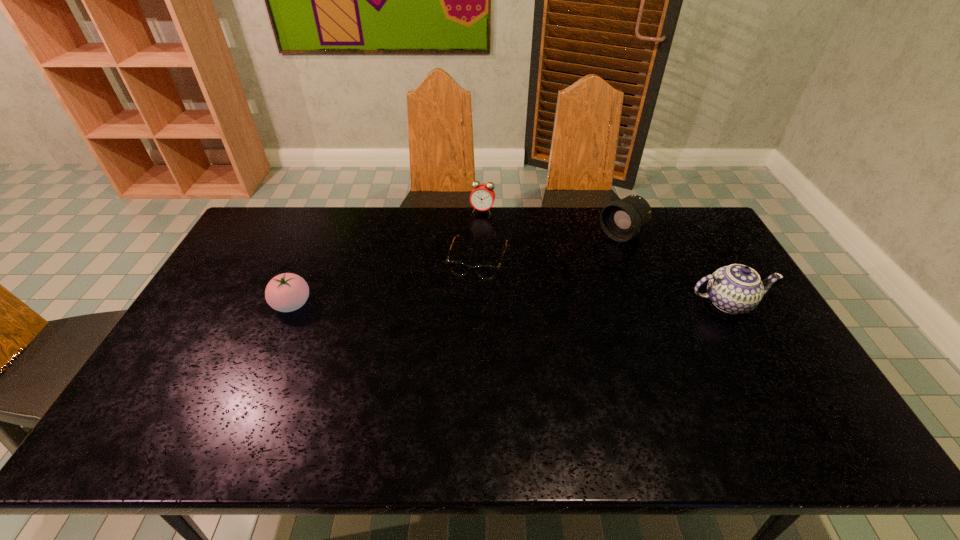
This screenshot has width=960, height=540. Find the location of `the leftmost object`. the leftmost object is located at coordinates (287, 292).

The width and height of the screenshot is (960, 540). I want to click on the rightmost object, so click(x=735, y=289).

Image resolution: width=960 pixels, height=540 pixels. I want to click on the shortest object, so click(487, 272).

The image size is (960, 540). In order to click on telephoto lens in this screenshot , I will do `click(621, 220)`.

Where is `alarm clock`? The height and width of the screenshot is (540, 960). alarm clock is located at coordinates (482, 197).

The width and height of the screenshot is (960, 540). Identify the location of vacant region located 0.150m on the front of the tomato. (268, 362).

Locate an element on the screen. vacant area situated at the spout of the rightmost object is located at coordinates (750, 343).

The height and width of the screenshot is (540, 960). I want to click on vacant area located 0.390m on the front-facing side of the spectacles, so click(x=440, y=384).

Locate an element on the screen. This screenshot has height=540, width=960. vacant space located on the front-facing side of the spectacles is located at coordinates (447, 359).

Locate an element on the screen. The image size is (960, 540). vacant area situated on the front-facing side of the spectacles is located at coordinates (463, 310).